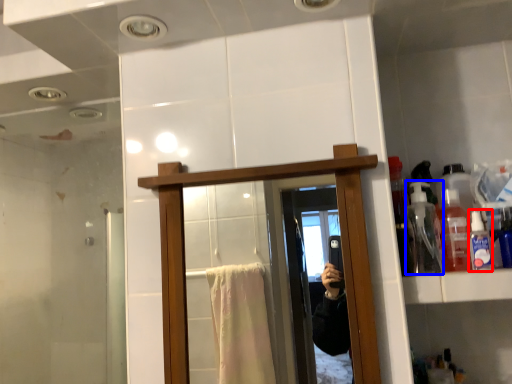
Question: Which point is further to the camera, toiletry (highlighted by a red box) or bottle (highlighted by a blue box)?

Choices:
 (A) toiletry
 (B) bottle

Answer: (B)